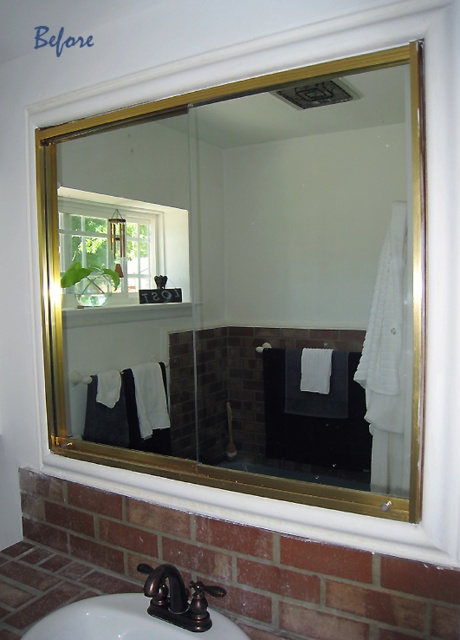
Who is shorter, gold metallic mirror at upper center or white fabric towel bar at center?

With less height is white fabric towel bar at center.

Can you confirm if gold metallic mirror at upper center is shorter than white fabric towel bar at center?

In fact, gold metallic mirror at upper center may be taller than white fabric towel bar at center.

Who is more forward, [349,150] or [262,344]?

Point [349,150]

Locate an element on the screen. The height and width of the screenshot is (640, 460). gold metallic mirror at upper center is located at coordinates (245, 284).

Is point (225, 92) farther from camera compared to point (82, 380)?

No, it is not.

Does gold metallic mirror at upper center appear on the left side of white matte towel bar at center?

Incorrect, gold metallic mirror at upper center is not on the left side of white matte towel bar at center.

You are a GUI agent. You are given a task and a screenshot of the screen. Output one action in this format:
    pyautogui.click(x=<x>, y=<y>)
    Task: Click on the gold metallic mirror at upper center
    
    Given the screenshot: What is the action you would take?
    pyautogui.click(x=245, y=284)

What do you see at coordinates (122, 621) in the screenshot? I see `matte black faucet at lower center` at bounding box center [122, 621].

Does point (138, 627) come farther from viewer compared to point (80, 378)?

No, it is in front of (80, 378).

The height and width of the screenshot is (640, 460). I want to click on matte black faucet at lower center, so click(122, 621).